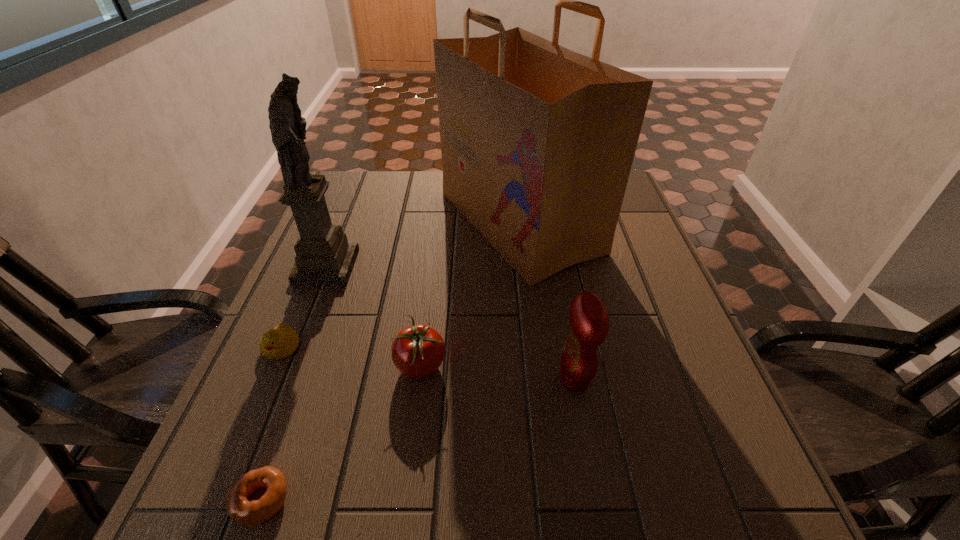
Image resolution: width=960 pixels, height=540 pixels. I want to click on object that is the fifth closest to the fourth tallest object, so click(324, 256).

Find the location of `vacant space that satisfies the following two spatial constraints: 1. on the face of the second shortest object; 2. on the left side of the doughnut`. vacant space that satisfies the following two spatial constraints: 1. on the face of the second shortest object; 2. on the left side of the doughnut is located at coordinates (217, 500).

The width and height of the screenshot is (960, 540). In order to click on vacant space that satisfies the following two spatial constraints: 1. on the front-facing side of the second tallest object; 2. on the face of the duckling in this screenshot , I will do `click(294, 348)`.

Identify the location of free space in the image that satisfies the following two spatial constraints: 1. on the face of the nearest object; 2. on the right side of the second shortest object. The width and height of the screenshot is (960, 540). (217, 500).

Where is `vacant space that satisfies the following two spatial constraints: 1. on the side of the grocery bag with the superhero design; 2. on the front side of the fourth tallest object`? The width and height of the screenshot is (960, 540). vacant space that satisfies the following two spatial constraints: 1. on the side of the grocery bag with the superhero design; 2. on the front side of the fourth tallest object is located at coordinates (536, 366).

Locate an element on the screen. The height and width of the screenshot is (540, 960). free space that satisfies the following two spatial constraints: 1. on the front-facing side of the nearest object; 2. on the left side of the sculpture is located at coordinates [x=233, y=500].

Find the location of a particular element. This screenshot has width=960, height=540. free space that satisfies the following two spatial constraints: 1. on the face of the shortest object; 2. on the right side of the second shortest object is located at coordinates (217, 500).